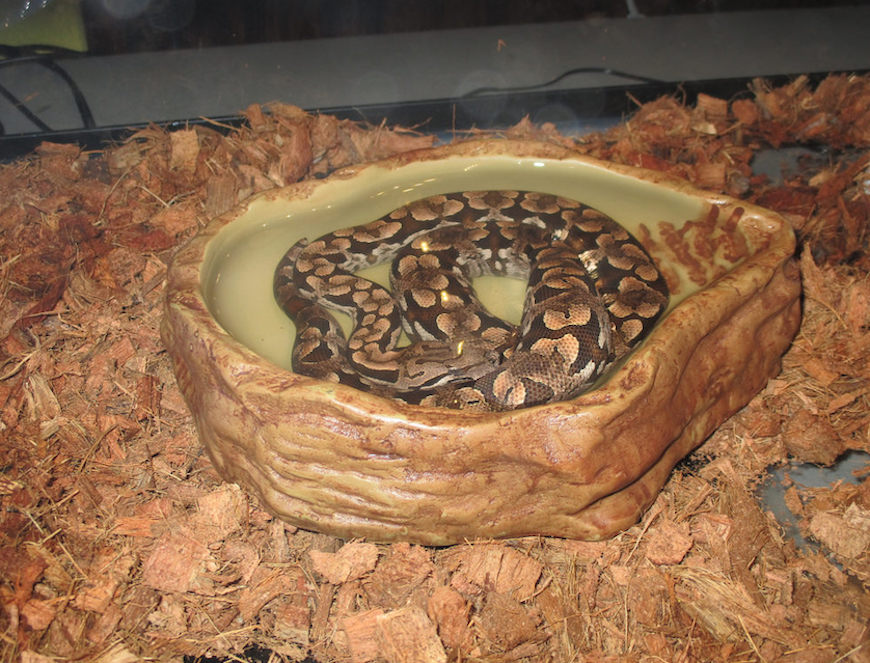
I want to click on cords, so click(84, 113), click(35, 117), click(599, 69).